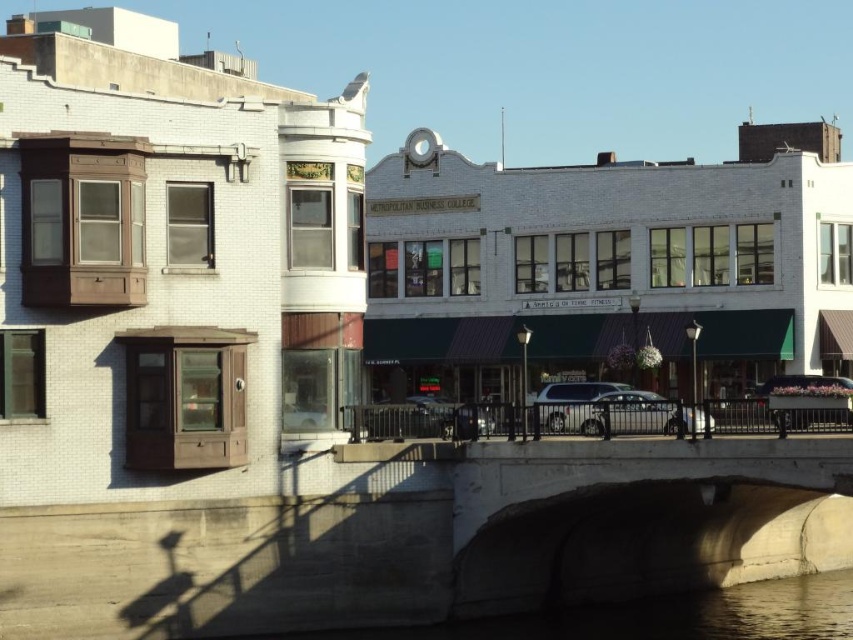
Between silver metallic suv at center and metallic silver car at center, which one is positioned higher?

metallic silver car at center is higher up.

Can you confirm if silver metallic suv at center is thinner than metallic silver car at center?

Yes, silver metallic suv at center is thinner than metallic silver car at center.

Which is in front, point (636, 422) or point (836, 413)?

Point (836, 413) is in front.

Image resolution: width=853 pixels, height=640 pixels. Identify the location of silver metallic suv at center. (612, 410).